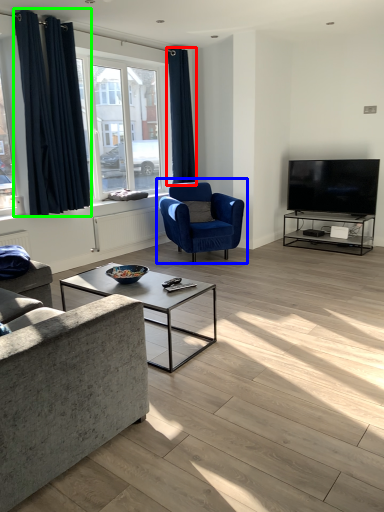
Question: Considering the real-world distances, which object is closest to curtain (highlighted by a red box)? chair (highlighted by a blue box) or curtain (highlighted by a green box).

Choices:
 (A) chair
 (B) curtain

Answer: (A)